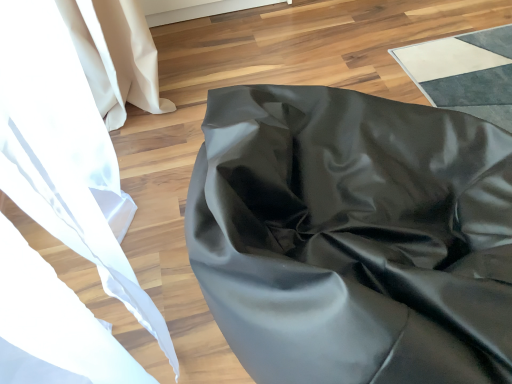
Describe the element at coordinates (353, 237) in the screenshot. This screenshot has width=512, height=384. I see `matte black bean bag at center` at that location.

Image resolution: width=512 pixels, height=384 pixels. What are the coordinates of `matte black bean bag at center` in the screenshot? It's located at (353, 237).

I want to click on matte black bean bag at center, so click(353, 237).